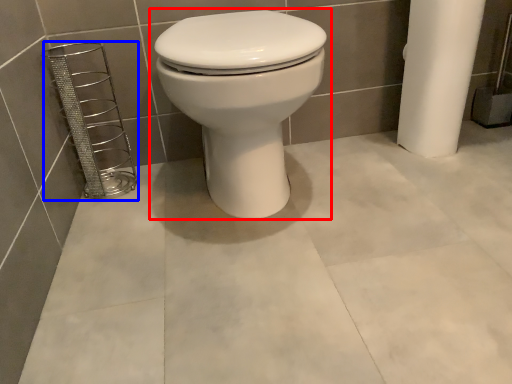
Question: Among these objects, which one is farthest to the camera, toilet (highlighted by a red box) or porcelain (highlighted by a blue box)?

Choices:
 (A) toilet
 (B) porcelain

Answer: (B)